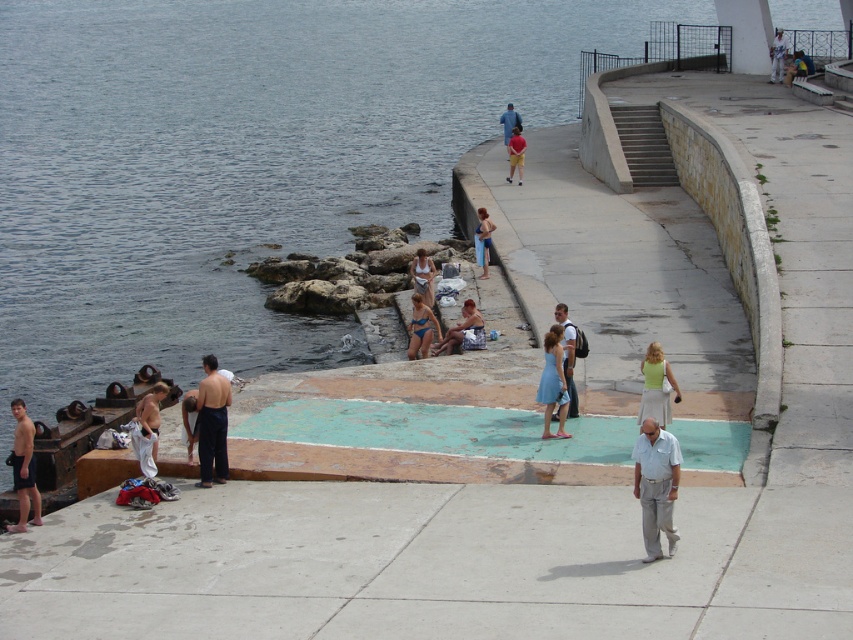
Question: Which object appears farthest from the camera in this image?

Choices:
 (A) white cotton shorts at lower left
 (B) green jersey skirt at center
 (C) blue fabric bikini at center

Answer: (C)

Question: Among these points, which one is nearest to the camera?

Choices:
 (A) (556, 435)
 (B) (641, 416)

Answer: (B)

Question: Which point is farther from the camera taking this photo?

Choices:
 (A) (566, 412)
 (B) (519, 163)

Answer: (B)

Question: Is dark blue pants at lower left behind light blue fabric dress at center?

Choices:
 (A) yes
 (B) no

Answer: (B)

Question: Considering the relative positions of light gray cotton pants at lower right and shiny metallic shirt at lower left in the image provided, where is light gray cotton pants at lower right located with respect to shiny metallic shirt at lower left?

Choices:
 (A) right
 (B) left

Answer: (A)

Question: Does light gray cotton pants at lower right appear under blue fabric bikini at center?

Choices:
 (A) yes
 (B) no

Answer: (A)